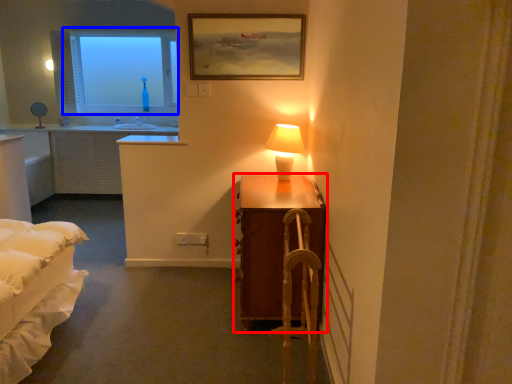
Question: Which object appears farthest to the camera in this image, table (highlighted by a red box) or window (highlighted by a blue box)?

Choices:
 (A) table
 (B) window

Answer: (B)